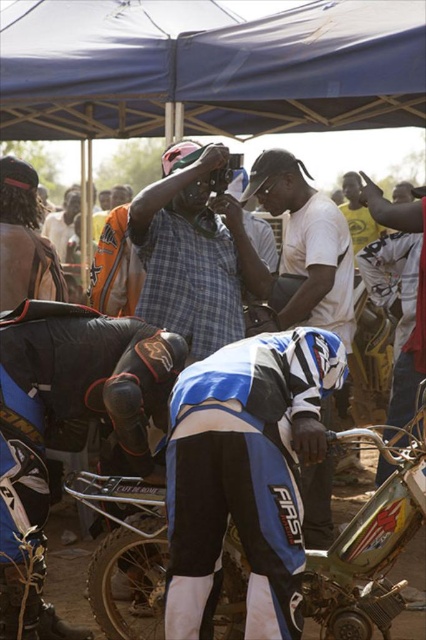
Is point (235, 378) positioned in front of point (310, 227)?

That is True.

The image size is (426, 640). What are the coordinates of `blue/white/striped motorcycle pants at center` in the screenshot? It's located at (245, 474).

Is blue/white/striped motorcycle pants at center behind metallic silver motorcycle at lower center?

No, blue/white/striped motorcycle pants at center is in front of metallic silver motorcycle at lower center.

Between blue/white/striped motorcycle pants at center and metallic silver motorcycle at lower center, which one has less height?

With less height is metallic silver motorcycle at lower center.

Identify the location of blue/white/striped motorcycle pants at center. This screenshot has height=640, width=426. (245, 474).

Identify the location of black matte motorcycle at lower left. The width and height of the screenshot is (426, 640). (66, 428).

Does point (117, 332) lie behind point (414, 516)?

Yes, it is behind point (414, 516).

Describe the element at coordinates (66, 428) in the screenshot. This screenshot has width=426, height=640. I see `black matte motorcycle at lower left` at that location.

Identify the location of black matte motorcycle at lower left. The height and width of the screenshot is (640, 426). (66, 428).